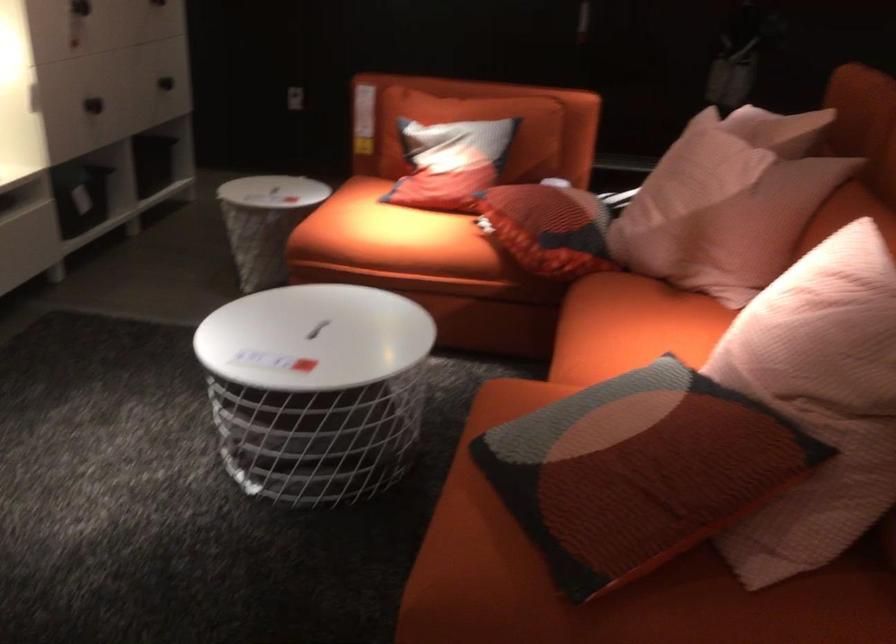
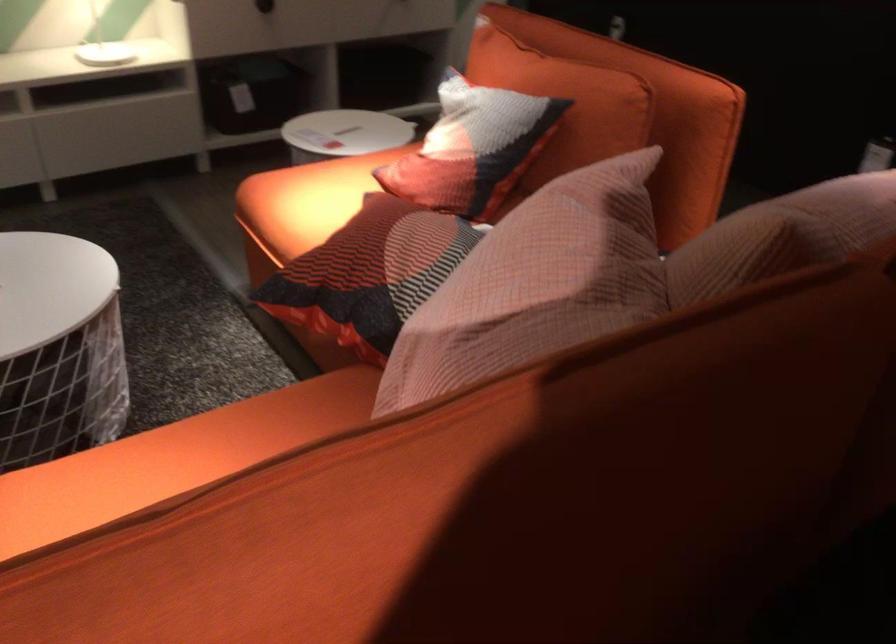
Locate, in the second image, the point that corresponds to point (514, 117) in the first image.

(564, 102)